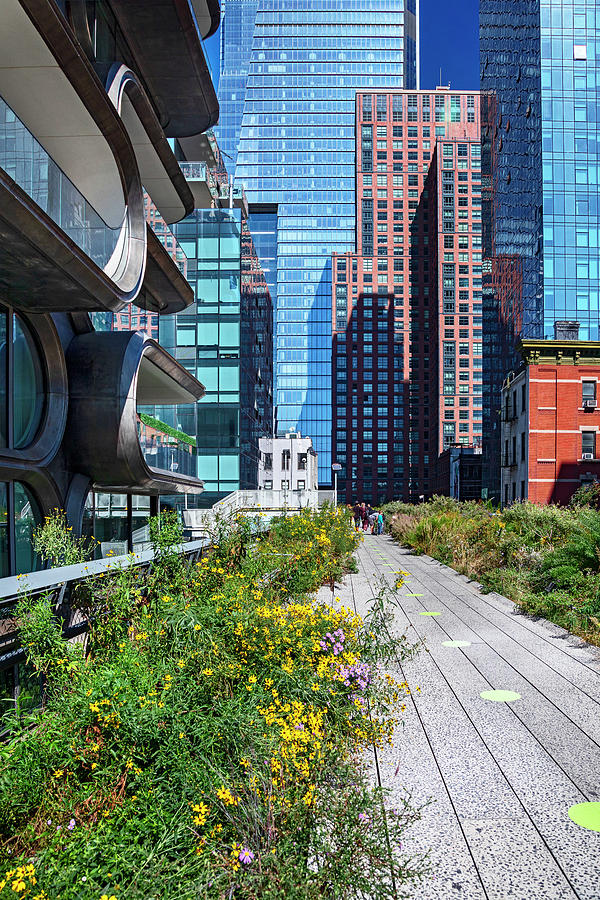
Where is `air conditioning unit`? Image resolution: width=600 pixels, height=900 pixels. air conditioning unit is located at coordinates (589, 405), (585, 456).